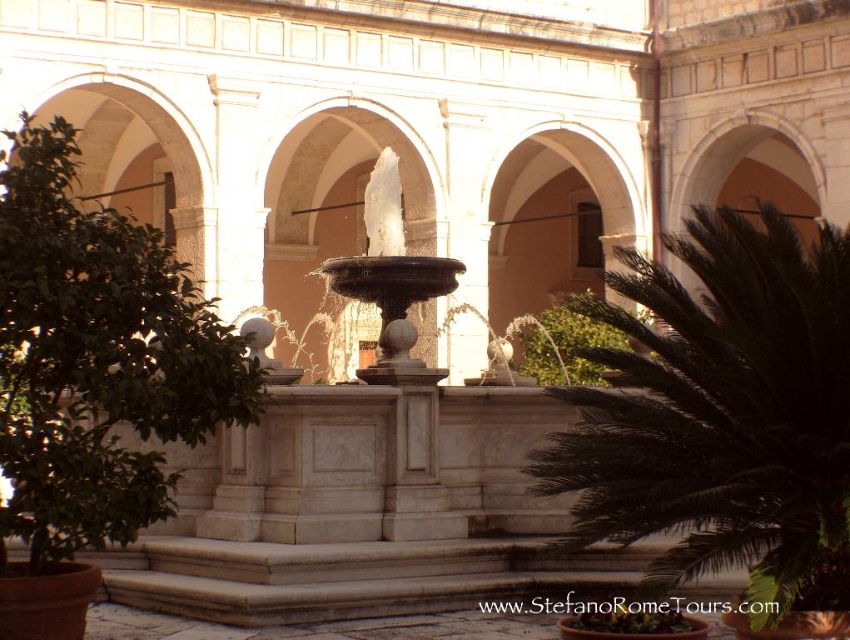
Looking at this image, does white marble fountain at center come behind green leafy plant at center?

Yes, it is.

Can you confirm if white marble fountain at center is positioned to the right of green leafy plant at center?

In fact, white marble fountain at center is to the left of green leafy plant at center.

This screenshot has width=850, height=640. I want to click on white marble fountain at center, so pyautogui.click(x=389, y=266).

Locate an element on the screen. The image size is (850, 640). white marble fountain at center is located at coordinates (389, 266).

Between green leafy tree at left and white marble fountain at center, which one has more height?

Standing taller between the two is green leafy tree at left.

Can you confirm if green leafy tree at left is positioned to the right of white marble fountain at center?

In fact, green leafy tree at left is to the left of white marble fountain at center.

Does point (44, 250) lie in front of point (382, 195)?

Yes, it is in front of point (382, 195).

Identify the location of green leafy tree at left. (97, 358).

Between dark green leafy palm at right and white marble fountain at center, which one is positioned higher?

white marble fountain at center is above.

Does dark green leafy palm at right appear under white marble fountain at center?

Indeed, dark green leafy palm at right is positioned under white marble fountain at center.

Where is `dark green leafy palm at right`? dark green leafy palm at right is located at coordinates tap(721, 413).